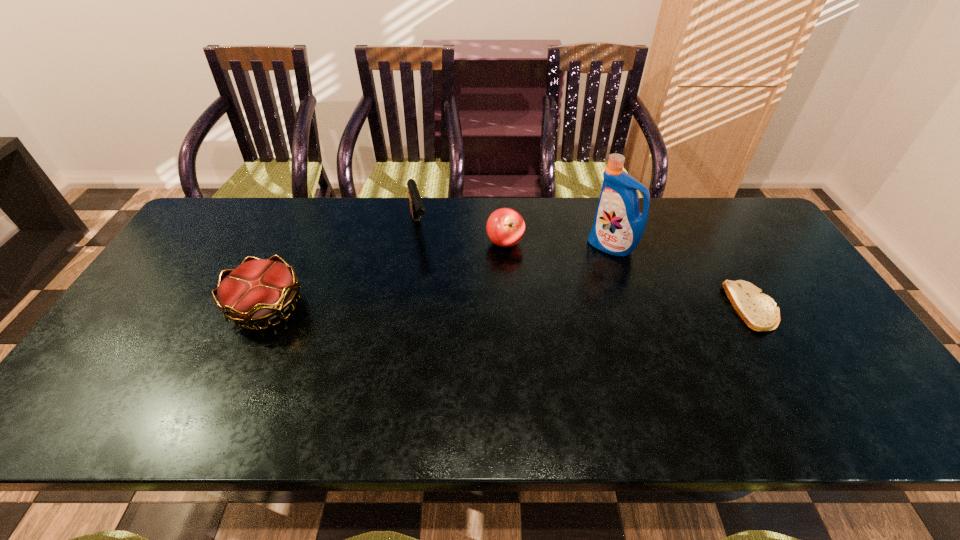
The width and height of the screenshot is (960, 540). Find the location of `apple situated at the far edge`. apple situated at the far edge is located at coordinates (505, 227).

The image size is (960, 540). Find the location of `pistol positioned at the far edge`. pistol positioned at the far edge is located at coordinates (417, 208).

Identify the location of object that is at the right edge. The width and height of the screenshot is (960, 540). (759, 311).

This screenshot has height=540, width=960. Identify the location of free space at the far edge of the desktop. (372, 218).

The width and height of the screenshot is (960, 540). What are the coordinates of `free region at the near edge of the desktop` in the screenshot? It's located at (455, 385).

Where is `free region at the left edge`? This screenshot has height=540, width=960. free region at the left edge is located at coordinates (195, 286).

This screenshot has width=960, height=540. Identify the location of free space at the right edge of the desktop. (833, 345).

The width and height of the screenshot is (960, 540). What are the coordinates of `free space at the far left corner of the desktop` in the screenshot? It's located at (242, 205).

I want to click on free space between the crown and the apple, so click(386, 275).

The height and width of the screenshot is (540, 960). Find the location of `empty space that is in between the rightmost object and the leftmost object`. empty space that is in between the rightmost object and the leftmost object is located at coordinates [x=510, y=307].